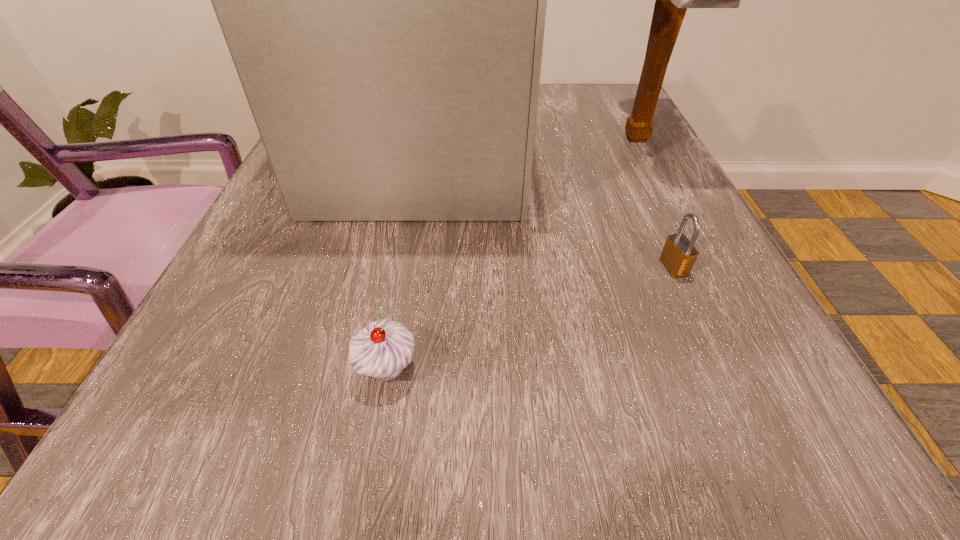
Locate an element on the screen. This screenshot has width=960, height=540. toaster oven is located at coordinates (383, 0).

You are a GUI agent. You are given a task and a screenshot of the screen. Output one action in this format:
    pyautogui.click(x=<x>, y=<y>)
    Task: Click on the mallet
    Image resolution: width=960 pixels, height=540 pixels.
    Given the screenshot: What is the action you would take?
    pyautogui.click(x=672, y=0)

Locate an element on the screen. cupcake is located at coordinates 382,349.

I want to click on the third tallest object, so click(x=382, y=349).

Locate an element on the screen. padlock is located at coordinates (679, 254).

Locate an element on the screen. The width and height of the screenshot is (960, 540). the third farthest object is located at coordinates tap(679, 254).

At what (x,y) coordinates should I click in order to perform the action: click on free space located 0.050m on the front panel of the toaster oven. Please return your answer as a coordinate pair (x, y). The height and width of the screenshot is (540, 960). Looking at the image, I should click on (556, 153).

Locate an element on the screen. The height and width of the screenshot is (540, 960). free space located 0.190m on the front of the mallet is located at coordinates (692, 246).

The image size is (960, 540). Identify the location of vacant space situated on the back of the cupcake. click(x=402, y=282).

Image resolution: width=960 pixels, height=540 pixels. Identify the location of vacant space located 0.280m on the left of the shortest object. [475, 267].